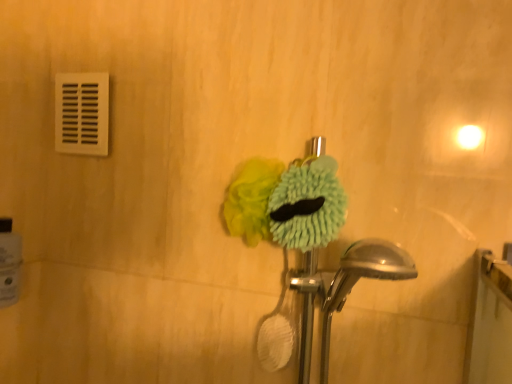
Question: From the image's perspective, is soft yellow sponge at center, the 1th flower positioned from the left, above or below green fuzzy brush at center, the second flower when ordered from left to right?

Choices:
 (A) above
 (B) below

Answer: (A)

Question: Considering the positions of soft yellow sponge at center, the 1th flower positioned from the left, and green fuzzy brush at center, the 1th flower viewed from the right, in the image, is soft yellow sponge at center, the 1th flower positioned from the left, bigger or smaller than green fuzzy brush at center, the 1th flower viewed from the right,?

Choices:
 (A) small
 (B) big

Answer: (B)

Question: Estimate the real-world distances between objects in this image. Which object is farther from the white plastic vent at upper left?

Choices:
 (A) white glossy toilet paper at lower left
 (B) soft yellow sponge at center, acting as the second flower starting from the right
 (C) green fuzzy brush at center, the second flower when ordered from left to right

Answer: (C)

Question: Considering the real-world distances, which object is closest to the white plastic vent at upper left?

Choices:
 (A) soft yellow sponge at center, acting as the second flower starting from the right
 (B) green fuzzy brush at center, the 1th flower viewed from the right
 (C) white glossy toilet paper at lower left

Answer: (C)